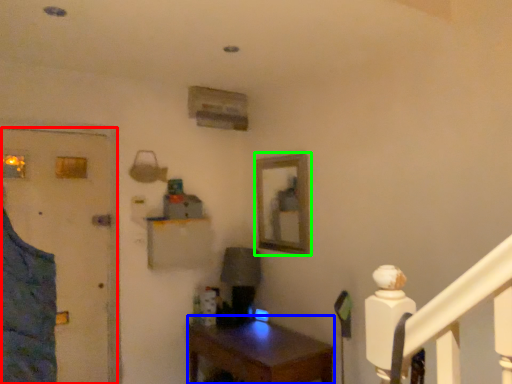
Question: Which object is positioned closest to door (highlighted by a red box)? Select from desk (highlighted by a blue box) and picture frame (highlighted by a green box).

Choices:
 (A) desk
 (B) picture frame

Answer: (A)